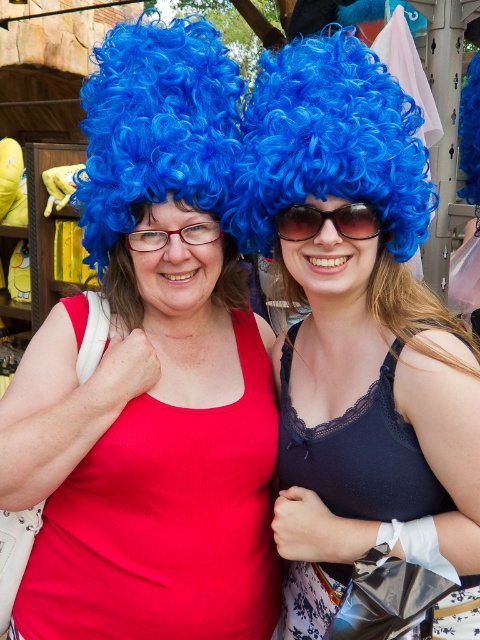
You are trying to decide which pair of glasses to buy as a souvenir from the market. You prefer something slim. Based on the image, which one between the sunglasses at center and the matte red glasses at center is thinner?

The sunglasses at center is thinner than the matte red glasses at center, so it would be the better choice for a slim preference.

You are a photographer adjusting the focus on your camera. You notice two pairs of glasses in the scene, the sunglasses at center and the matte red glasses at center. Which pair of glasses should you focus on first if you want to capture the larger one clearly?

The sunglasses at center has a larger size compared to the matte red glasses at center, so you should focus on the sunglasses at center first to capture the larger one clearly.